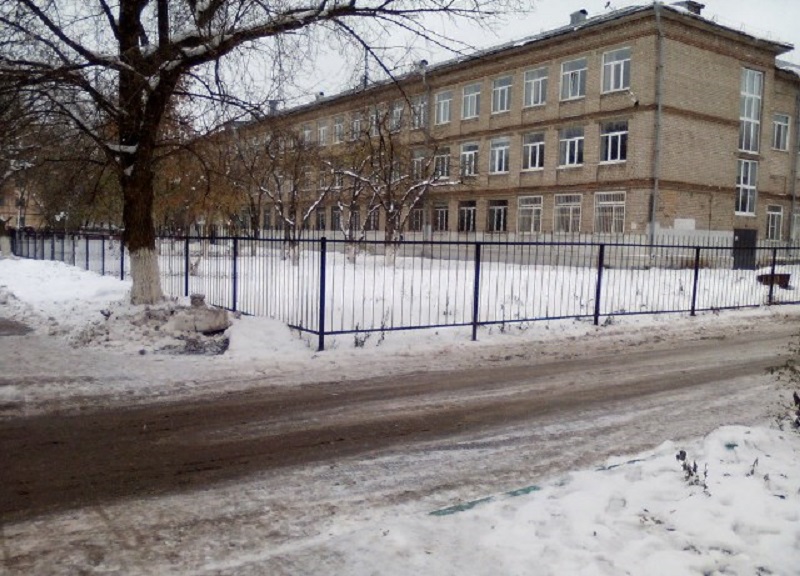
In order to click on long rectangular window area in this screenshot , I will do `click(752, 113)`.